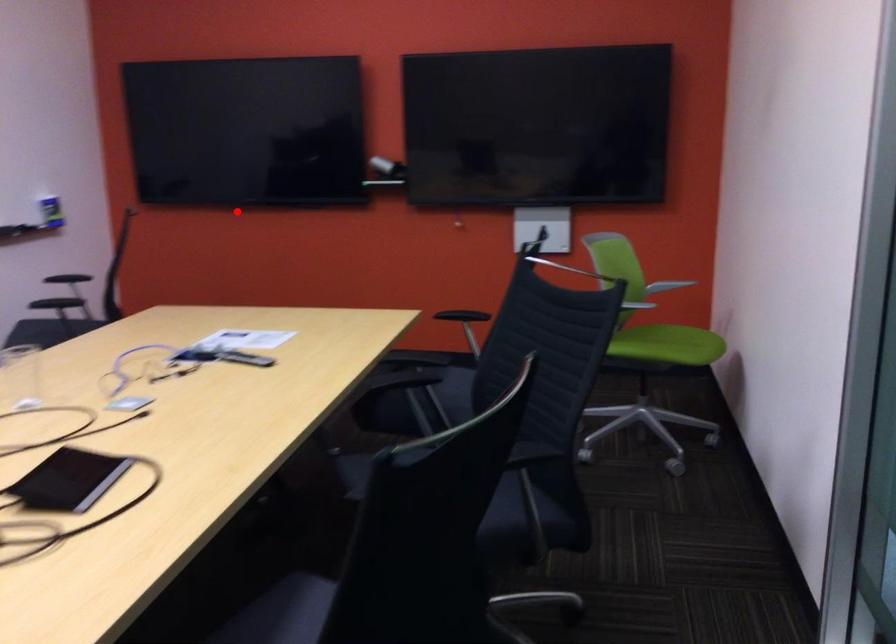
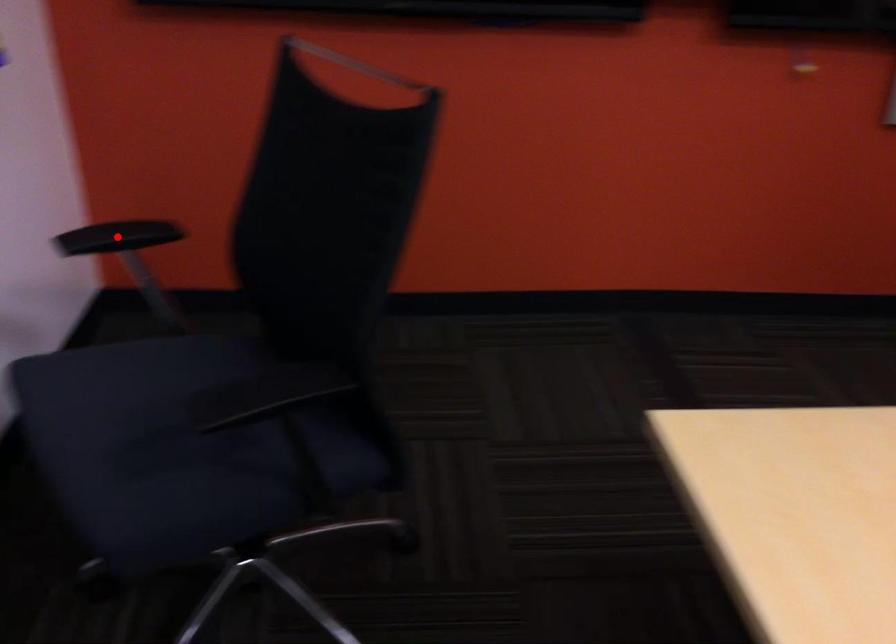
I am providing you with two images of the same scene from different viewpoints. A red point is marked on the first image and another point is marked on the second image. Is the marked point in image1 the same physical position as the marked point in image2?

No